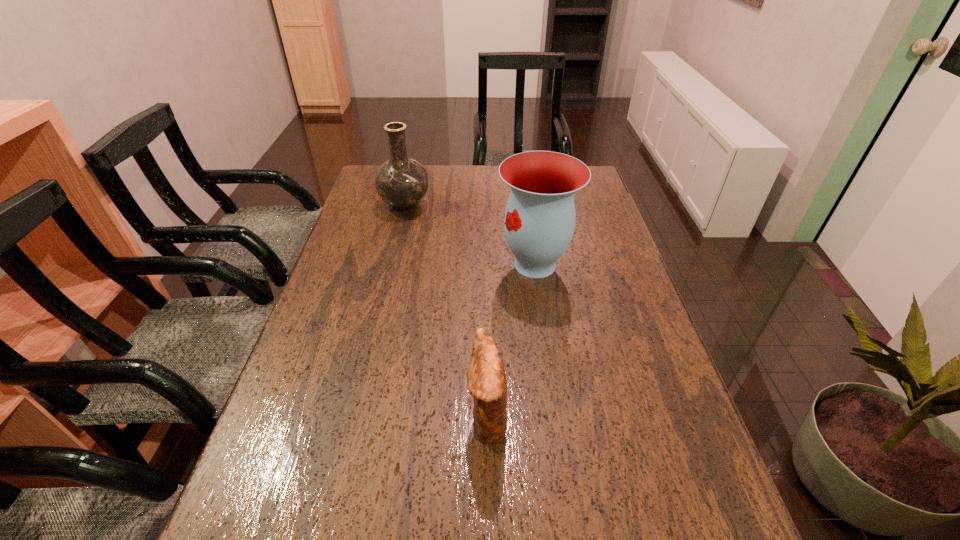
Identify which object is the closest to the nearer vase. Please provide its 2D coordinates. Your answer should be formatted as a tuple, i.e. [(x, y)], where the tuple contains the x and y coordinates of a point satisfying the conditions above.

[(402, 182)]

The image size is (960, 540). Find the location of `free location that satisfies the following two spatial constraints: 1. on the front side of the right vase; 2. on the open side of the nearest object`. free location that satisfies the following two spatial constraints: 1. on the front side of the right vase; 2. on the open side of the nearest object is located at coordinates pyautogui.click(x=558, y=417).

The image size is (960, 540). What are the coordinates of `free location that satisfies the following two spatial constraints: 1. on the front side of the leftmost object; 2. on the right side of the right vase` in the screenshot? It's located at (391, 265).

Image resolution: width=960 pixels, height=540 pixels. In order to click on free location that satisfies the following two spatial constraints: 1. on the front side of the right vase; 2. on the left side of the leftmost object in this screenshot , I will do `click(391, 265)`.

Locate an element on the screen. free spot that satisfies the following two spatial constraints: 1. on the front side of the farther vase; 2. on the left side of the nearer vase is located at coordinates (391, 265).